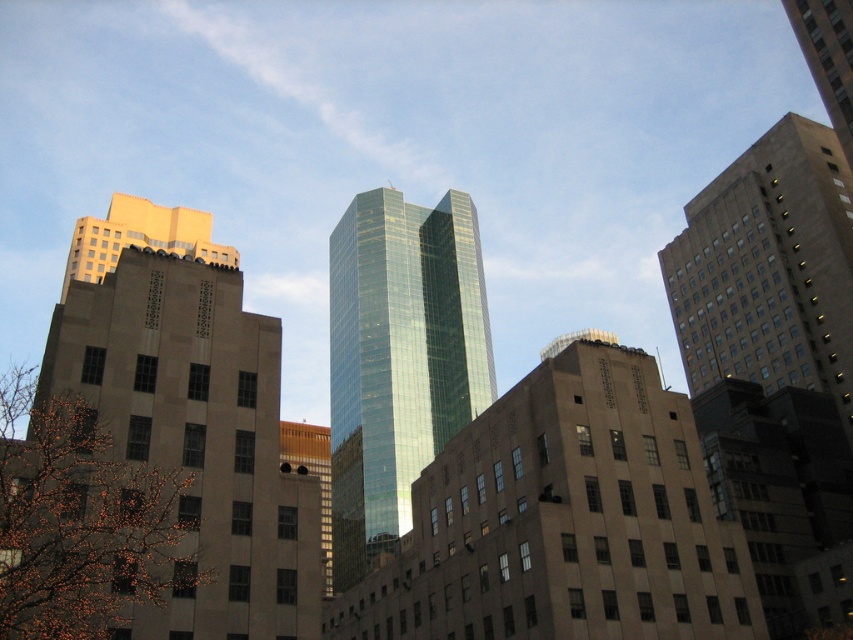
From the picture: You are standing in the city and see two points in the image. The first point is at coordinates point (337, 413) and the second is at point (833, 29). Which point is closer to you?

Point (337, 413) is further to the viewer than point (833, 29), so the second point is closer to you.

You are a drone operator tasked with capturing aerial footage of the city. Your drone is currently positioned at the coordinates of the green glass skyscraper at center. To ensure a smooth flight path, you need to know the exact location of this skyscraper. What are its coordinates?

The green glass skyscraper at center is located at point (399, 358).